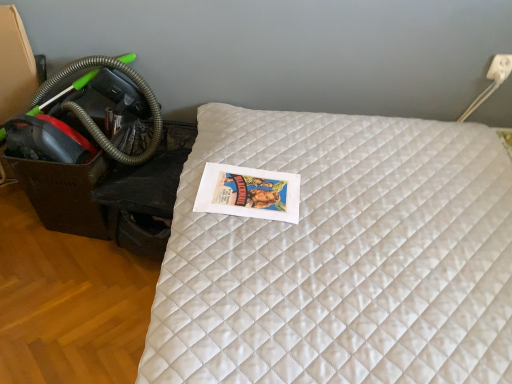
I want to click on white quilted mattress at center, so click(341, 257).

Is white plastic electric outlet at upper right positioned behind green rubber garden hose at left?

Yes, the depth of white plastic electric outlet at upper right is greater than that of green rubber garden hose at left.

Considering the positions of objects white plastic electric outlet at upper right and green rubber garden hose at left in the image provided, who is more to the right, white plastic electric outlet at upper right or green rubber garden hose at left?

From the viewer's perspective, white plastic electric outlet at upper right appears more on the right side.

Can green rubber garden hose at left be found inside white plastic electric outlet at upper right?

No.

Identify the location of garden hose located underneath the white plastic electric outlet at upper right (from a real-world perspective). (91, 118).

Is point (496, 187) farther from viewer compared to point (498, 59)?

No, it is in front of (498, 59).

In the image, is white quilted mattress at center positioned in front of or behind white plastic electric outlet at upper right?

white quilted mattress at center is positioned closer to the viewer than white plastic electric outlet at upper right.

Is white plastic electric outlet at upper right inside white quilted mattress at center?

No, white quilted mattress at center does not contain white plastic electric outlet at upper right.

Considering the sizes of objects white quilted mattress at center and white plastic electric outlet at upper right in the image provided, who is thinner, white quilted mattress at center or white plastic electric outlet at upper right?

Thinner between the two is white plastic electric outlet at upper right.

From the image's perspective, is white quilted mattress at center beneath green rubber garden hose at left?

Correct, white quilted mattress at center appears lower than green rubber garden hose at left in the image.

At what (x,y) coordinates should I click in order to perform the action: click on garden hose above the white quilted mattress at center (from the image's perspective). Please return your answer as a coordinate pair (x, y). The height and width of the screenshot is (384, 512). Looking at the image, I should click on (91, 118).

Based on their positions, is white quilted mattress at center located to the left or right of green rubber garden hose at left?

In the image, white quilted mattress at center appears on the right side of green rubber garden hose at left.

How much distance is there between green rubber garden hose at left and white quilted mattress at center?

29.62 inches.

Where is `garden hose that is behind the white quilted mattress at center`? Image resolution: width=512 pixels, height=384 pixels. garden hose that is behind the white quilted mattress at center is located at coordinates (91, 118).

Who is smaller, green rubber garden hose at left or white quilted mattress at center?

green rubber garden hose at left is smaller.

Considering the sizes of objects green rubber garden hose at left and white quilted mattress at center in the image provided, who is taller, green rubber garden hose at left or white quilted mattress at center?

white quilted mattress at center is taller.

Where is `bed below the white plastic electric outlet at upper right (from a real-world perspective)`? bed below the white plastic electric outlet at upper right (from a real-world perspective) is located at coordinates (341, 257).

Is white quilted mattress at center at the back of white plastic electric outlet at upper right?

No, white plastic electric outlet at upper right is not facing away from white quilted mattress at center.

Is white plastic electric outlet at upper right touching white quilted mattress at center?

They are not placed beside each other.

Between white plastic electric outlet at upper right and white quilted mattress at center, which one has larger width?

Wider between the two is white quilted mattress at center.

Is green rubber garden hose at left positioned with its back to white plastic electric outlet at upper right?

No, green rubber garden hose at left is not facing the opposite direction of white plastic electric outlet at upper right.

Consider the image. How far apart are green rubber garden hose at left and white plastic electric outlet at upper right?

A distance of 1.39 meters exists between green rubber garden hose at left and white plastic electric outlet at upper right.

From the image's perspective, who appears lower, green rubber garden hose at left or white plastic electric outlet at upper right?

green rubber garden hose at left, from the image's perspective.

Is green rubber garden hose at left further to camera compared to white plastic electric outlet at upper right?

No, it is not.

Identify the location of electric outlet behind the green rubber garden hose at left. Image resolution: width=512 pixels, height=384 pixels. (500, 67).

At what (x,y) coordinates should I click in order to perform the action: click on bed in front of the white plastic electric outlet at upper right. Please return your answer as a coordinate pair (x, y). This screenshot has height=384, width=512. Looking at the image, I should click on (341, 257).

When comparing their distances from white quilted mattress at center, does white plastic electric outlet at upper right or green rubber garden hose at left seem further?

white plastic electric outlet at upper right is positioned further to the anchor white quilted mattress at center.

When comparing their distances from white plastic electric outlet at upper right, does green rubber garden hose at left or white quilted mattress at center seem further?

Based on the image, green rubber garden hose at left appears to be further to white plastic electric outlet at upper right.

Consider the image. Considering their positions, is white plastic electric outlet at upper right positioned further to green rubber garden hose at left than white quilted mattress at center?

white plastic electric outlet at upper right lies further to green rubber garden hose at left than the other object.

When comparing their distances from white plastic electric outlet at upper right, does white quilted mattress at center or green rubber garden hose at left seem further?

green rubber garden hose at left.

In the scene shown: Which object lies nearer to the anchor point green rubber garden hose at left, white quilted mattress at center or white plastic electric outlet at upper right?

white quilted mattress at center is closer to green rubber garden hose at left.

In the scene shown: When comparing their distances from white quilted mattress at center, does green rubber garden hose at left or white plastic electric outlet at upper right seem further?

white plastic electric outlet at upper right is positioned further to the anchor white quilted mattress at center.

You are a GUI agent. You are given a task and a screenshot of the screen. Output one action in this format:
    pyautogui.click(x=<x>, y=<y>)
    Task: Click on the bed situated between green rubber garden hose at left and white plastic electric outlet at upper right from left to right
    This screenshot has width=512, height=384.
    Given the screenshot: What is the action you would take?
    pyautogui.click(x=341, y=257)